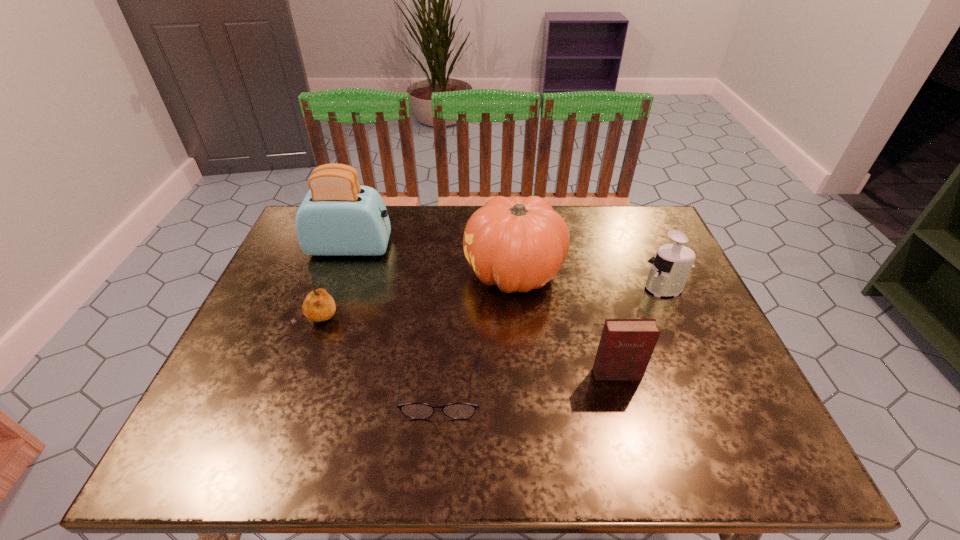
Image resolution: width=960 pixels, height=540 pixels. What are the coordinates of `free space that satisfies the following two spatial constraints: 1. on the carved face of the second tallest object; 2. on the back side of the rightmost object` in the screenshot? It's located at (516, 288).